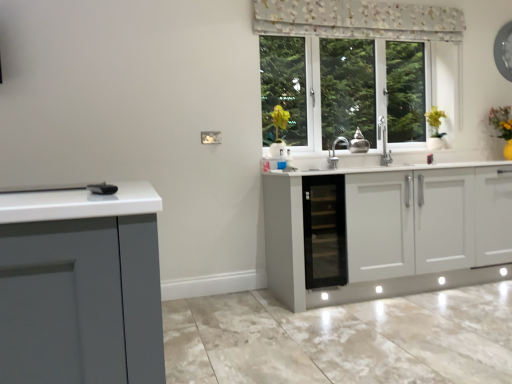
Locate an element on the screen. yellow matte plant at upper right is located at coordinates (503, 127).

Locate an element on the screen. This screenshot has height=384, width=512. black glass cabinet at center is located at coordinates (324, 231).

Would you consider black glass cabinet at center to be distant from floral fabric curtain at upper center?

Absolutely, black glass cabinet at center is distant from floral fabric curtain at upper center.

From the image's perspective, is black glass cabinet at center above floral fabric curtain at upper center?

No.

Considering the sizes of objects floral fabric curtain at upper center and black glass cabinet at center in the image provided, who is wider, floral fabric curtain at upper center or black glass cabinet at center?

Wider between the two is black glass cabinet at center.

From the picture: From the image's perspective, is floral fabric curtain at upper center located above or below black glass cabinet at center?

floral fabric curtain at upper center is situated higher than black glass cabinet at center in the image.

Is point (324, 29) closer to viewer compared to point (339, 188)?

No, (324, 29) is behind (339, 188).

Considering the sizes of objects yellow matte plant at upper right and black glass cabinet at center in the image provided, who is wider, yellow matte plant at upper right or black glass cabinet at center?

black glass cabinet at center.

Considering the sizes of objects yellow matte plant at upper right and black glass cabinet at center in the image provided, who is bigger, yellow matte plant at upper right or black glass cabinet at center?

black glass cabinet at center is bigger.

Which object is positioned more to the right, yellow matte plant at upper right or black glass cabinet at center?

Positioned to the right is yellow matte plant at upper right.

Which point is more forward, (501, 130) or (312, 180)?

Point (312, 180)

Is black glass cabinet at center oriented away from yellow matte plant at upper right?

No, yellow matte plant at upper right is not at the back of black glass cabinet at center.

Does black glass cabinet at center have a larger size compared to yellow matte plant at upper right?

Indeed, black glass cabinet at center has a larger size compared to yellow matte plant at upper right.

From the picture: Considering the relative sizes of black glass cabinet at center and yellow matte plant at upper right in the image provided, is black glass cabinet at center shorter than yellow matte plant at upper right?

No.

Is black glass cabinet at center not within yellow matte plant at upper right?

That's correct, black glass cabinet at center is outside of yellow matte plant at upper right.

Could you tell me if yellow matte plant at upper right is turned towards floral fabric curtain at upper center?

No, yellow matte plant at upper right is not oriented towards floral fabric curtain at upper center.

Can you confirm if yellow matte plant at upper right is smaller than floral fabric curtain at upper center?

No, yellow matte plant at upper right is not smaller than floral fabric curtain at upper center.

Considering the positions of objects yellow matte plant at upper right and floral fabric curtain at upper center in the image provided, who is more to the left, yellow matte plant at upper right or floral fabric curtain at upper center?

floral fabric curtain at upper center is more to the left.

Is yellow matte plant at upper right inside the boundaries of floral fabric curtain at upper center, or outside?

yellow matte plant at upper right is located beyond the bounds of floral fabric curtain at upper center.

Which of these two, floral fabric curtain at upper center or yellow matte plant at upper right, is wider?

With larger width is yellow matte plant at upper right.

Between floral fabric curtain at upper center and yellow matte plant at upper right, which one appears on the right side from the viewer's perspective?

Positioned to the right is yellow matte plant at upper right.

From a real-world perspective, which is physically above, floral fabric curtain at upper center or yellow matte plant at upper right?

floral fabric curtain at upper center, from a real-world perspective.

This screenshot has width=512, height=384. In order to click on dish washer on the left of floral fabric curtain at upper center in this screenshot , I will do `click(324, 231)`.

Find the location of a particular element. The height and width of the screenshot is (384, 512). curtain that appears above the black glass cabinet at center (from the image's perspective) is located at coordinates (358, 19).

When comparing their distances from yellow matte plant at upper right, does floral fabric curtain at upper center or black glass cabinet at center seem further?

black glass cabinet at center is positioned further to the anchor yellow matte plant at upper right.

When comparing their distances from floral fabric curtain at upper center, does yellow matte plant at upper right or black glass cabinet at center seem closer?

yellow matte plant at upper right lies closer to floral fabric curtain at upper center than the other object.

From the image, which object appears to be nearer to black glass cabinet at center, yellow matte plant at upper right or floral fabric curtain at upper center?

The object closer to black glass cabinet at center is floral fabric curtain at upper center.

Looking at the image, which one is located further to floral fabric curtain at upper center, black glass cabinet at center or yellow matte plant at upper right?

black glass cabinet at center is positioned further to the anchor floral fabric curtain at upper center.

Based on their spatial positions, is floral fabric curtain at upper center or yellow matte plant at upper right closer to black glass cabinet at center?

floral fabric curtain at upper center is positioned closer to the anchor black glass cabinet at center.

When comparing their distances from yellow matte plant at upper right, does black glass cabinet at center or floral fabric curtain at upper center seem further?

black glass cabinet at center lies further to yellow matte plant at upper right than the other object.

The height and width of the screenshot is (384, 512). What are the coordinates of `curtain located between black glass cabinet at center and yellow matte plant at upper right in the left-right direction` in the screenshot? It's located at (358, 19).